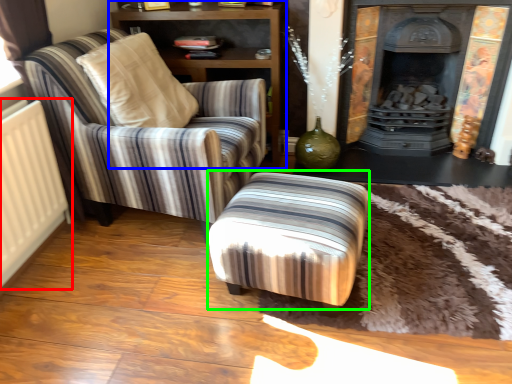
Question: Which object is the farthest from radiator (highlighted by a red box)? Choose among these: shelf (highlighted by a blue box) or stool (highlighted by a green box).

Choices:
 (A) shelf
 (B) stool

Answer: (A)